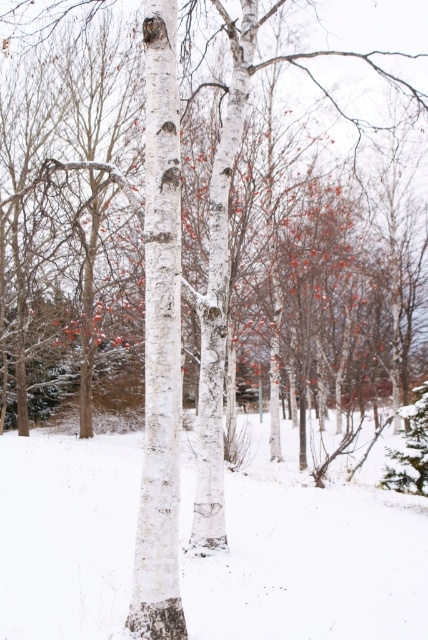
You are standing in the winter scene and want to place a small red ornament exactly at the center of the image. However, there is already white matte snow at center. Where should you place the ornament to avoid covering the snow?

The white matte snow at center is located at point (309, 560), so you should place the ornament slightly to the left and upwards from that position to avoid covering it.

You are an observer standing in the winter scene. You notice the white matte snow at center and the white matte tree trunk at center. Which one appears taller in the image?

The white matte tree trunk at center is taller than the white matte snow at center.

You are standing in the winter scene and want to place a small red ornament exactly at the point marked as point (x=309, y=560). What will the ornament be placed on?

The ornament will be placed on the white matte snow at center located at point (x=309, y=560).